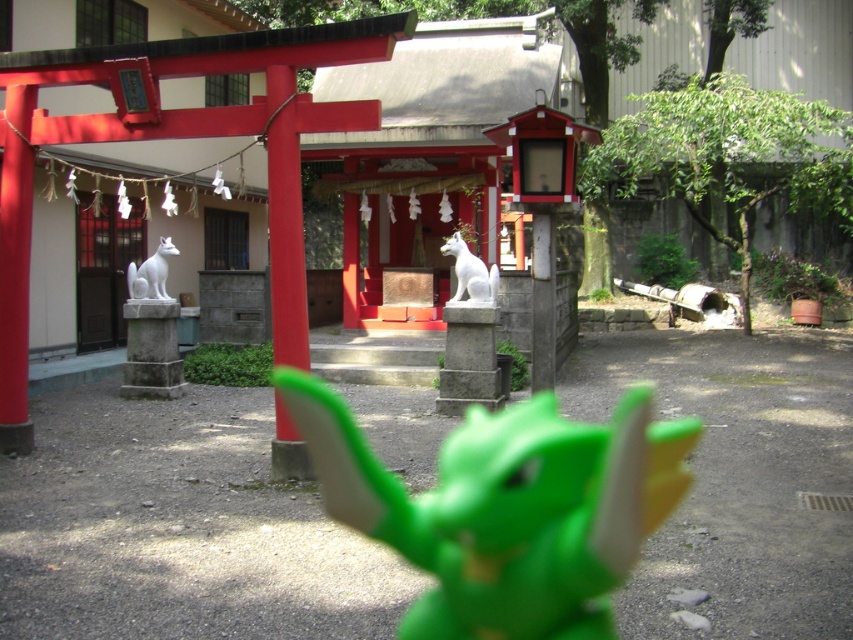
Question: Which is nearer to the white glossy statue at center?

Choices:
 (A) white marble fox at center
 (B) green plastic toy at center

Answer: (B)

Question: Can you confirm if white glossy statue at center is bigger than white marble fox at center?

Choices:
 (A) yes
 (B) no

Answer: (A)

Question: Where is white glossy statue at center located in relation to white marble fox at center in the image?

Choices:
 (A) above
 (B) below

Answer: (B)

Question: Does white glossy statue at center have a larger size compared to white marble fox at center?

Choices:
 (A) no
 (B) yes

Answer: (B)

Question: Which object is farther from the camera taking this photo?

Choices:
 (A) white marble fox at center
 (B) green plastic toy at center
 (C) white glossy statue at center

Answer: (A)

Question: Estimate the real-world distances between objects in this image. Which object is closer to the white glossy statue at center?

Choices:
 (A) green plastic toy at center
 (B) white marble fox at center

Answer: (A)